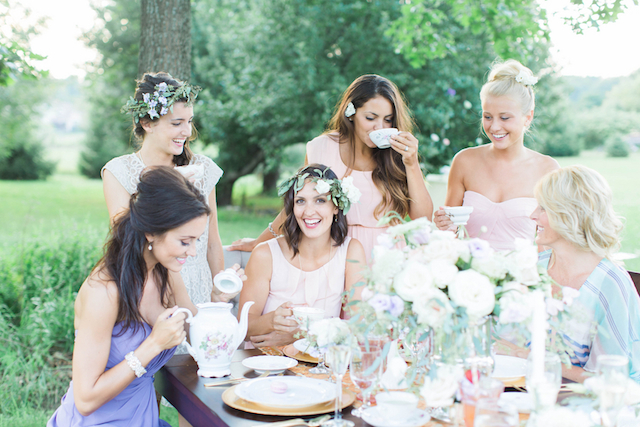
Image resolution: width=640 pixels, height=427 pixels. Identify the location of plate. (288, 396), (276, 411), (267, 365), (507, 364).